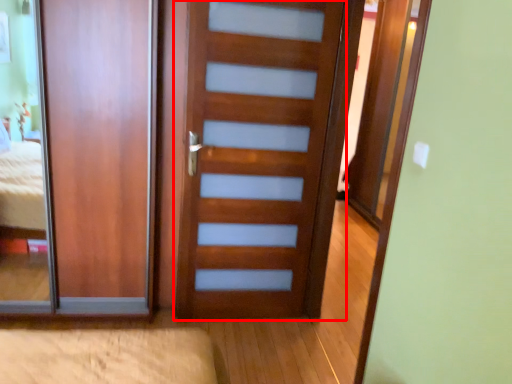
Question: From the image's perspective, considering the relative positions of door (annotated by the red box) and door in the image provided, where is door (annotated by the red box) located with respect to the staircase?

Choices:
 (A) below
 (B) above

Answer: (A)